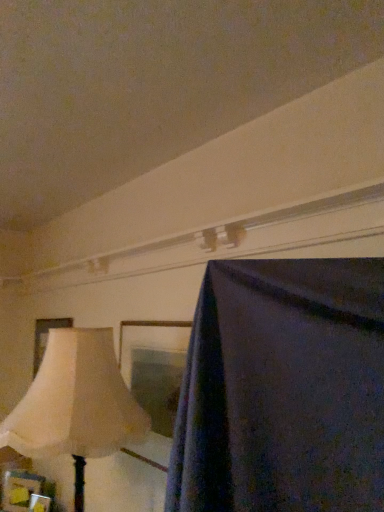
Question: Considering the positions of wooden picture frame at lower left, marked as the second picture frame in a bottom-to-top arrangement, and beige fabric lampshade at left in the image, is wooden picture frame at lower left, marked as the second picture frame in a bottom-to-top arrangement, bigger or smaller than beige fabric lampshade at left?

Choices:
 (A) big
 (B) small

Answer: (B)

Question: Is wooden picture frame at lower left, marked as the second picture frame in a bottom-to-top arrangement, inside or outside of beige fabric lampshade at left?

Choices:
 (A) outside
 (B) inside

Answer: (A)

Question: Estimate the real-world distances between objects in this image. Which object is farther from the beige fabric lampshade at left?

Choices:
 (A) matte cream picture frame at left, the first picture frame when ordered from back to front
 (B) wooden picture frame at lower left, marked as the third picture frame in a top-to-bottom arrangement
 (C) wooden picture frame at lower left, placed as the second picture frame when sorted from top to bottom

Answer: (B)

Question: Which object is positioned farthest from the matte cream picture frame at left, which is the third picture frame from front to back?

Choices:
 (A) beige fabric lampshade at left
 (B) wooden picture frame at lower left, marked as the second picture frame in a bottom-to-top arrangement
 (C) wooden picture frame at lower left, the 2th picture frame from the back

Answer: (A)